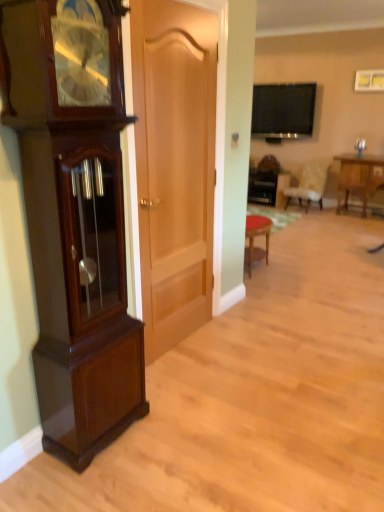
Find the location of a particular element. free spot in front of mahogany wood grandfather clock at left is located at coordinates (88, 485).